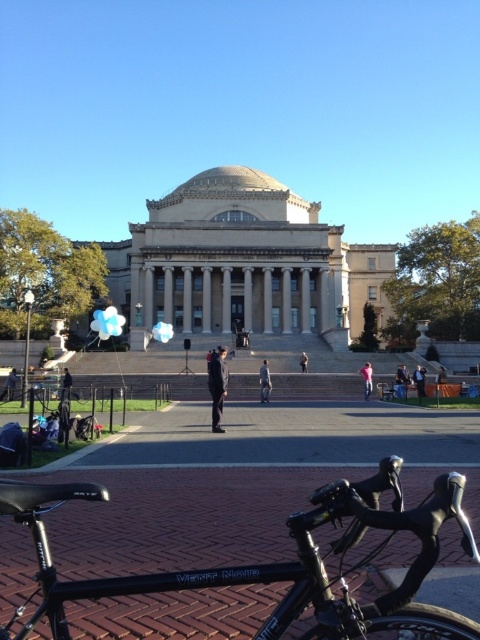
Question: Which point is closer to the camera?

Choices:
 (A) dark blue suit at center
 (B) light blue fabric person at center

Answer: (A)

Question: Based on their relative distances, which object is farther from the light blue fabric person at center?

Choices:
 (A) dark blue jacket at lower left
 (B) dark blue suit at center
 (C) black matte bicycle at lower left
 (D) dark blue fabric jacket at center

Answer: (C)

Question: Where is light blue fabric person at center located in relation to dark blue jacket at lower left in the image?

Choices:
 (A) above
 (B) below

Answer: (A)

Question: Is black fabric jacket at lower left closer to camera compared to camouflage fabric jacket at center?

Choices:
 (A) yes
 (B) no

Answer: (A)

Question: Which of the following is the farthest from the observer?

Choices:
 (A) (421, 372)
 (B) (262, 387)
 (C) (372, 371)

Answer: (C)

Question: Can you confirm if dark blue jacket at lower left is positioned below dark blue suit at center?

Choices:
 (A) yes
 (B) no

Answer: (A)